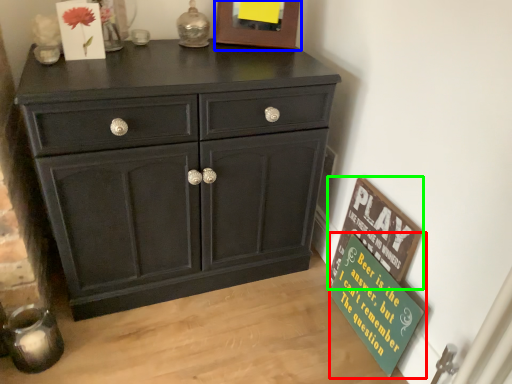
Question: Which object is positioned closest to bulletin board (highlighted by a red box)? Select from picture frame (highlighted by a blue box) and bulletin board (highlighted by a green box).

Choices:
 (A) picture frame
 (B) bulletin board

Answer: (B)